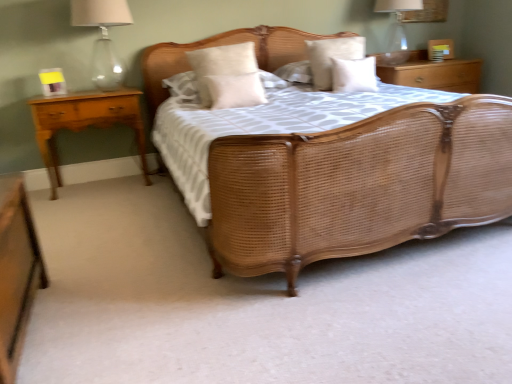
Identify the location of wooden nightstand at upper right, positioned as the 3th nightstand in left-to-right order. This screenshot has width=512, height=384. 433,73.

Measure the distance between woven wood bed at center and camera.

A distance of 5.01 feet exists between woven wood bed at center and camera.

Where is `woven wood bed at center`? woven wood bed at center is located at coordinates (358, 186).

Image resolution: width=512 pixels, height=384 pixels. Describe the element at coordinates (234, 90) in the screenshot. I see `beige fabric pillow at center, which is counted as the third pillow, starting from the right` at that location.

Describe the element at coordinates (354, 75) in the screenshot. I see `white soft pillow at center, which is the 1th pillow from right to left` at that location.

What do you see at coordinates (16, 271) in the screenshot? This screenshot has height=384, width=512. I see `wooden nightstand at lower left, placed as the second nightstand when sorted from right to left` at bounding box center [16, 271].

Image resolution: width=512 pixels, height=384 pixels. What do you see at coordinates (396, 30) in the screenshot?
I see `matte glass lampshade at upper right, the 1th bedside lamp from the back` at bounding box center [396, 30].

The height and width of the screenshot is (384, 512). I want to click on wooden nightstand at upper right, the third nightstand from the front, so click(433, 73).

From the image's perspective, is beige fabric pillow at center, the 2th pillow from the left, on top of matte glass lamp at upper left, which is the first bedside lamp from front to back?

No, from the image's perspective, beige fabric pillow at center, the 2th pillow from the left, is not over matte glass lamp at upper left, which is the first bedside lamp from front to back.

Is beige fabric pillow at center, the 2th pillow from the left, in front of or behind matte glass lamp at upper left, which is the first bedside lamp from front to back, in the image?

beige fabric pillow at center, the 2th pillow from the left, is positioned farther from the viewer than matte glass lamp at upper left, which is the first bedside lamp from front to back.

Is beige fabric pillow at center, the 2th pillow from the left, shorter than matte glass lamp at upper left, placed as the first bedside lamp when sorted from left to right?

Yes, beige fabric pillow at center, the 2th pillow from the left, is shorter than matte glass lamp at upper left, placed as the first bedside lamp when sorted from left to right.

Consider the image. What's the angular difference between beige fabric pillow at center, the 2th pillow from the left, and matte glass lamp at upper left, placed as the first bedside lamp when sorted from left to right,'s facing directions?

4.68 degrees.

Looking at this image, is white soft pillow at upper center, the 3th pillow in the left-to-right sequence, touching matte glass lampshade at upper right, the 2th bedside lamp from the front?

white soft pillow at upper center, the 3th pillow in the left-to-right sequence, and matte glass lampshade at upper right, the 2th bedside lamp from the front, are not in contact.

From a real-world perspective, is white soft pillow at upper center, the 3th pillow in the left-to-right sequence, beneath matte glass lampshade at upper right, the first bedside lamp when ordered from right to left?

Indeed, from a real-world perspective, white soft pillow at upper center, the 3th pillow in the left-to-right sequence, is positioned beneath matte glass lampshade at upper right, the first bedside lamp when ordered from right to left.

Identify the location of the 1st bedside lamp positioned above the white soft pillow at upper center, the 3th pillow in the left-to-right sequence (from a real-world perspective). (396, 30).

From the image's perspective, is white soft pillow at center, which is the 1th pillow from right to left, located above or below matte glass lampshade at upper right, the 1th bedside lamp from the back?

From the image's perspective, white soft pillow at center, which is the 1th pillow from right to left, appears below matte glass lampshade at upper right, the 1th bedside lamp from the back.

Is matte glass lampshade at upper right, placed as the 2th bedside lamp when sorted from left to right, completely or partially inside white soft pillow at center, arranged as the fourth pillow when viewed from the left?

No, matte glass lampshade at upper right, placed as the 2th bedside lamp when sorted from left to right, is located outside of white soft pillow at center, arranged as the fourth pillow when viewed from the left.

Can you confirm if white soft pillow at center, arranged as the fourth pillow when viewed from the left, is thinner than matte glass lampshade at upper right, placed as the 2th bedside lamp when sorted from left to right?

Correct, the width of white soft pillow at center, arranged as the fourth pillow when viewed from the left, is less than that of matte glass lampshade at upper right, placed as the 2th bedside lamp when sorted from left to right.

Is white soft pillow at center, which is the 1th pillow from right to left, positioned far away from matte glass lampshade at upper right, the 1th bedside lamp from the back?

That's not correct — white soft pillow at center, which is the 1th pillow from right to left, is a little close to matte glass lampshade at upper right, the 1th bedside lamp from the back.

Between wooden nightstand at upper right, positioned as the 3th nightstand in left-to-right order, and light brown wood nightstand at left, marked as the second nightstand in a back-to-front arrangement, which one appears on the right side from the viewer's perspective?

Positioned to the right is wooden nightstand at upper right, positioned as the 3th nightstand in left-to-right order.

Is the depth of wooden nightstand at upper right, the third nightstand from the front, greater than that of light brown wood nightstand at left, which is the second nightstand in bottom-to-top order?

Yes, wooden nightstand at upper right, the third nightstand from the front, is behind light brown wood nightstand at left, which is the second nightstand in bottom-to-top order.

Choose the correct answer: Is wooden nightstand at upper right, acting as the 3th nightstand starting from the bottom, inside light brown wood nightstand at left, placed as the first nightstand when sorted from left to right, or outside it?

wooden nightstand at upper right, acting as the 3th nightstand starting from the bottom, cannot be found inside light brown wood nightstand at left, placed as the first nightstand when sorted from left to right.

Is the depth of wooden nightstand at lower left, placed as the second nightstand when sorted from right to left, greater than that of matte glass lamp at upper left, which is the second bedside lamp in right-to-left order?

No, wooden nightstand at lower left, placed as the second nightstand when sorted from right to left, is closer to the camera.

Are wooden nightstand at lower left, which ranks as the 3th nightstand in back-to-front order, and matte glass lamp at upper left, the 2th bedside lamp when ordered from back to front, beside each other?

wooden nightstand at lower left, which ranks as the 3th nightstand in back-to-front order, and matte glass lamp at upper left, the 2th bedside lamp when ordered from back to front, are clearly separated.

What's the angular difference between wooden nightstand at lower left, marked as the 1th nightstand in a front-to-back arrangement, and matte glass lamp at upper left, the 2th bedside lamp when ordered from back to front,'s facing directions?

wooden nightstand at lower left, marked as the 1th nightstand in a front-to-back arrangement, and matte glass lamp at upper left, the 2th bedside lamp when ordered from back to front, are facing 87.8 degrees away from each other.

Who is taller, wooden nightstand at lower left, positioned as the first nightstand in bottom-to-top order, or matte glass lamp at upper left, which is the second bedside lamp in right-to-left order?

matte glass lamp at upper left, which is the second bedside lamp in right-to-left order.

Considering the relative positions of matte glass lamp at upper left, placed as the first bedside lamp when sorted from left to right, and beige fabric pillow at center, which is the fourth pillow from right to left, in the image provided, is matte glass lamp at upper left, placed as the first bedside lamp when sorted from left to right, behind beige fabric pillow at center, which is the fourth pillow from right to left,?

No.

Between point (80, 13) and point (237, 58), which one is positioned behind?

The point (237, 58) is behind.

Considering the relative sizes of matte glass lamp at upper left, which is the second bedside lamp in right-to-left order, and beige fabric pillow at center, which is the fourth pillow from right to left, in the image provided, is matte glass lamp at upper left, which is the second bedside lamp in right-to-left order, smaller than beige fabric pillow at center, which is the fourth pillow from right to left,?

Actually, matte glass lamp at upper left, which is the second bedside lamp in right-to-left order, might be larger than beige fabric pillow at center, which is the fourth pillow from right to left.

Based on the photo, considering the relative sizes of matte glass lamp at upper left, which is the first bedside lamp from front to back, and beige fabric pillow at center, which appears as the 1th pillow when viewed from the left, in the image provided, is matte glass lamp at upper left, which is the first bedside lamp from front to back, taller than beige fabric pillow at center, which appears as the 1th pillow when viewed from the left,?

Indeed, matte glass lamp at upper left, which is the first bedside lamp from front to back, has a greater height compared to beige fabric pillow at center, which appears as the 1th pillow when viewed from the left.

Locate an element on the screen. The width and height of the screenshot is (512, 384). the 2nd pillow in front of the light brown wood nightstand at left, which is the second nightstand from front to back, counting from the anchor's position is located at coordinates coord(234,90).

Is point (256, 92) positioned in front of point (118, 102)?

Yes, it is.

From a real-world perspective, which is physically below, beige fabric pillow at center, the 2th pillow from the left, or light brown wood nightstand at left, which is the 2th nightstand from top to bottom?

light brown wood nightstand at left, which is the 2th nightstand from top to bottom, from a real-world perspective.

From a real-world perspective, starting from the beige fabric pillow at center, the 2th pillow from the left, which bedside lamp is the 2nd one vertically above it? Please provide its 2D coordinates.

[(103, 37)]

Locate an element on the screen. Image resolution: width=512 pixels, height=384 pixels. the 1st pillow in front of the matte glass lampshade at upper right, placed as the 2th bedside lamp when sorted from left to right is located at coordinates (330, 57).

Estimate the real-world distances between objects in this image. Which object is closer to beige fabric pillow at center, which appears as the 1th pillow when viewed from the left, beige fabric pillow at center, which is counted as the third pillow, starting from the right, or white soft pillow at center, which is the 1th pillow from right to left?

beige fabric pillow at center, which is counted as the third pillow, starting from the right, is positioned closer to the anchor beige fabric pillow at center, which appears as the 1th pillow when viewed from the left.

Estimate the real-world distances between objects in this image. Which object is further from white soft pillow at center, which is the 1th pillow from right to left, wooden nightstand at lower left, placed as the third nightstand when sorted from top to bottom, or light brown wood nightstand at left, which is the second nightstand from front to back?

wooden nightstand at lower left, placed as the third nightstand when sorted from top to bottom.

Estimate the real-world distances between objects in this image. Which object is closer to wooden nightstand at upper right, positioned as the 3th nightstand in left-to-right order, beige fabric pillow at center, which is the fourth pillow from right to left, or light brown wood nightstand at left, which is the second nightstand in bottom-to-top order?

beige fabric pillow at center, which is the fourth pillow from right to left.

Which object lies nearer to the anchor point wooden nightstand at upper right, acting as the 3th nightstand starting from the bottom, white soft pillow at upper center, acting as the second pillow starting from the right, or white soft pillow at center, which is the 1th pillow from right to left?

white soft pillow at center, which is the 1th pillow from right to left.

Considering their positions, is wooden nightstand at upper right, acting as the 3th nightstand starting from the bottom, positioned further to matte glass lamp at upper left, which is the first bedside lamp from front to back, than woven wood bed at center?

wooden nightstand at upper right, acting as the 3th nightstand starting from the bottom, lies further to matte glass lamp at upper left, which is the first bedside lamp from front to back, than the other object.

Estimate the real-world distances between objects in this image. Which object is closer to light brown wood nightstand at left, which is the second nightstand in bottom-to-top order, white soft pillow at upper center, acting as the second pillow starting from the right, or beige fabric pillow at center, the 2th pillow from the left?

beige fabric pillow at center, the 2th pillow from the left, lies closer to light brown wood nightstand at left, which is the second nightstand in bottom-to-top order, than the other object.

Looking at this image, estimate the real-world distances between objects in this image. Which object is further from matte glass lampshade at upper right, placed as the 2th bedside lamp when sorted from left to right, light brown wood nightstand at left, the third nightstand viewed from the right, or beige fabric pillow at center, which is the fourth pillow from right to left?

Based on the image, light brown wood nightstand at left, the third nightstand viewed from the right, appears to be further to matte glass lampshade at upper right, placed as the 2th bedside lamp when sorted from left to right.

When comparing their distances from white soft pillow at center, which is the 1th pillow from right to left, does wooden nightstand at lower left, marked as the 1th nightstand in a front-to-back arrangement, or beige fabric pillow at center, the 2th pillow from the left, seem further?

Among the two, wooden nightstand at lower left, marked as the 1th nightstand in a front-to-back arrangement, is located further to white soft pillow at center, which is the 1th pillow from right to left.

Locate an element on the screen. The width and height of the screenshot is (512, 384). bedside lamp situated between white soft pillow at upper center, the 3th pillow in the left-to-right sequence, and wooden nightstand at upper right, the third nightstand from the front, from left to right is located at coordinates (396, 30).

Image resolution: width=512 pixels, height=384 pixels. I want to click on bedside lamp situated between light brown wood nightstand at left, the third nightstand viewed from the right, and matte glass lampshade at upper right, the 1th bedside lamp from the back, from left to right, so click(x=103, y=37).

Find the location of a particular element. pillow between woven wood bed at center and beige fabric pillow at center, which appears as the 1th pillow when viewed from the left, from front to back is located at coordinates (234, 90).

I want to click on bedside lamp situated between matte glass lamp at upper left, which is the first bedside lamp from front to back, and wooden nightstand at upper right, the first nightstand in the top-to-bottom sequence, from left to right, so click(396, 30).